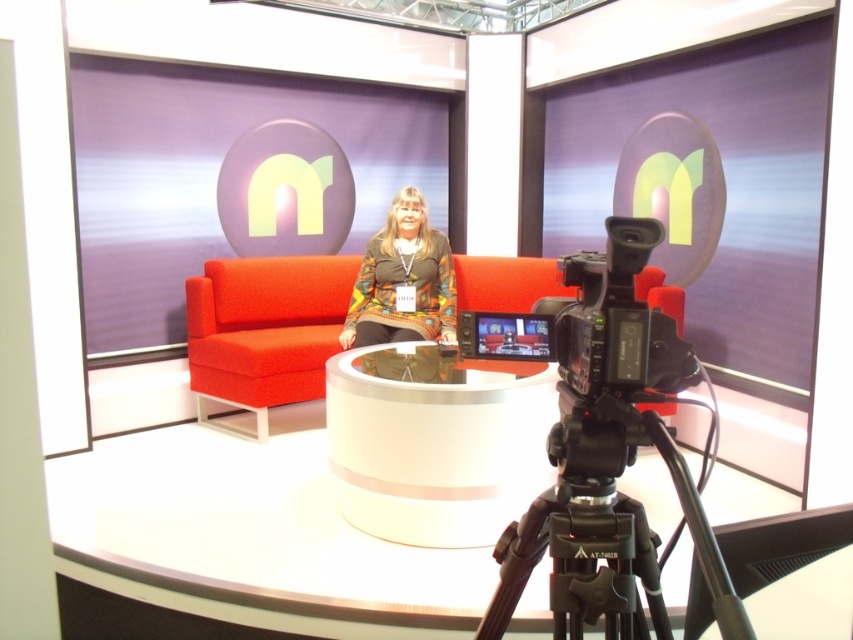
You are a stagehand setting up equipment in the studio. You need to place a new microphone stand to the left of the knitted sweater at center. Can you place it without moving the black plastic tripod at lower center?

The black plastic tripod at lower center is to the right of the knitted sweater at center, so placing the microphone stand to the left of the knitted sweater at center would not interfere with the tripod as it is on the right side.

You are a stagehand setting up for a live event. You need to place a microphone stand between the velvet orange couch at center and the knitted sweater at center. Based on their positions, which object should the microphone stand be placed closer to?

The microphone stand should be placed closer to the knitted sweater at center because the velvet orange couch at center is located below it, meaning the sweater is higher up and the couch is lower. Since the microphone stand is placed between them vertically, positioning it near the higher object ensures it is accessible.

From the picture: You are standing in the studio and want to place a small plant on the floor. The plant requires a spot that is exactly 4 meters away from where you are standing. Is the point at coordinates point (224,385) suitable for placing the plant?

The distance of point (224,385) from viewer is 3.88 meters, so the point is too close. The plant requires a spot exactly 4 meters away, so this point is not suitable.